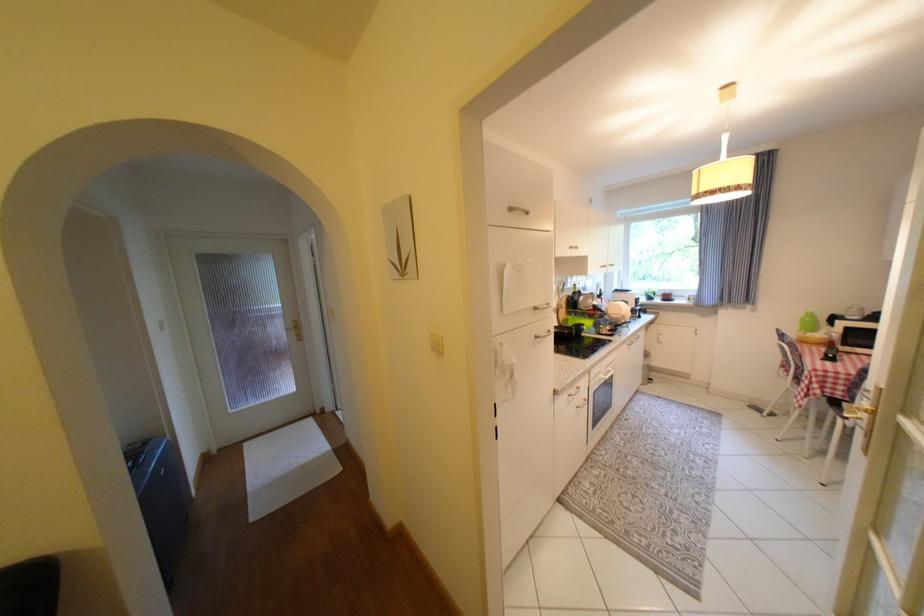
Where is `beige plate`? Image resolution: width=924 pixels, height=616 pixels. beige plate is located at coordinates click(x=618, y=310).